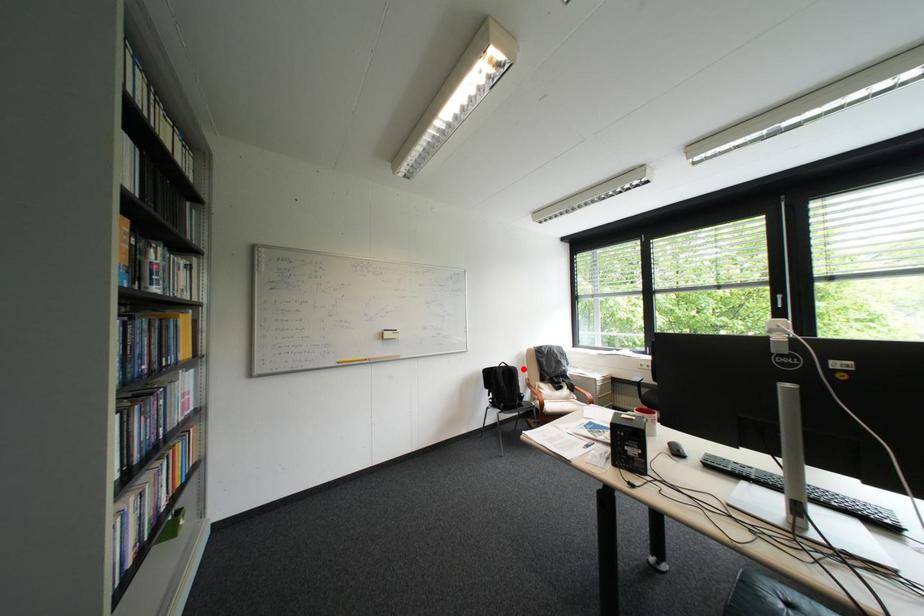
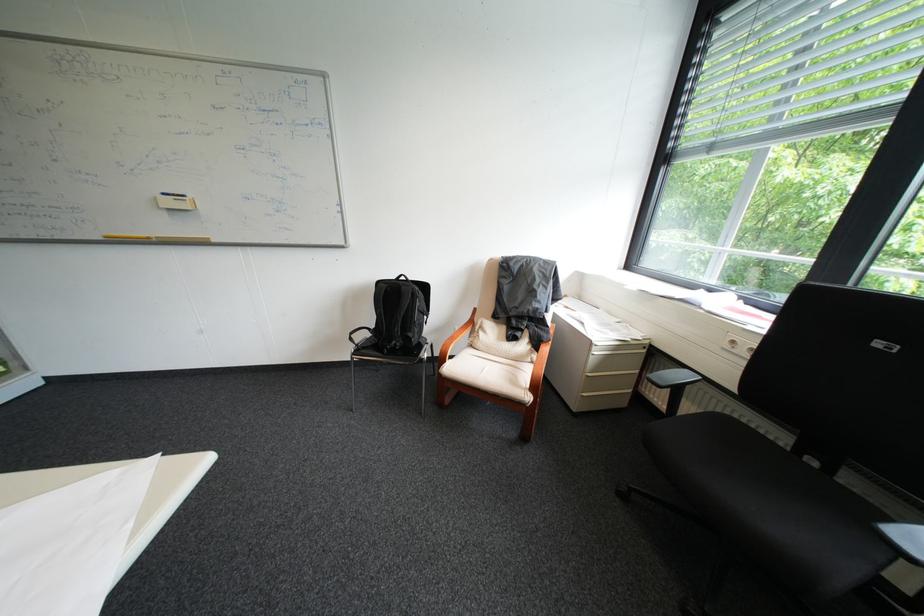
In the second image, find the point that corresponds to the highlighted location in the first image.

(415, 288)